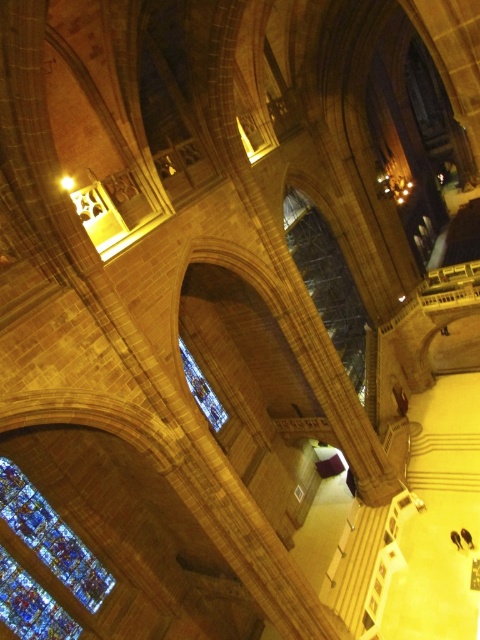
You are standing inside a cathedral and looking up. You notice two windows at the center. The clear glass window at center and the stained glass window at center. Which one is higher?

The clear glass window at center is located above the stained glass window at center, so it is higher.

You are standing inside the cathedral and want to compare the heights of the clear glass window at center and the stained glass window at lower left. Which one is taller?

The clear glass window at center is taller than the stained glass window at lower left.